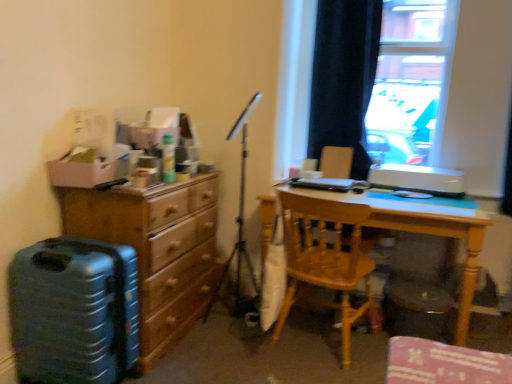
Find the location of a particular element. vacant space underneath wooden chair at center (from a real-world perspective) is located at coordinates (315, 345).